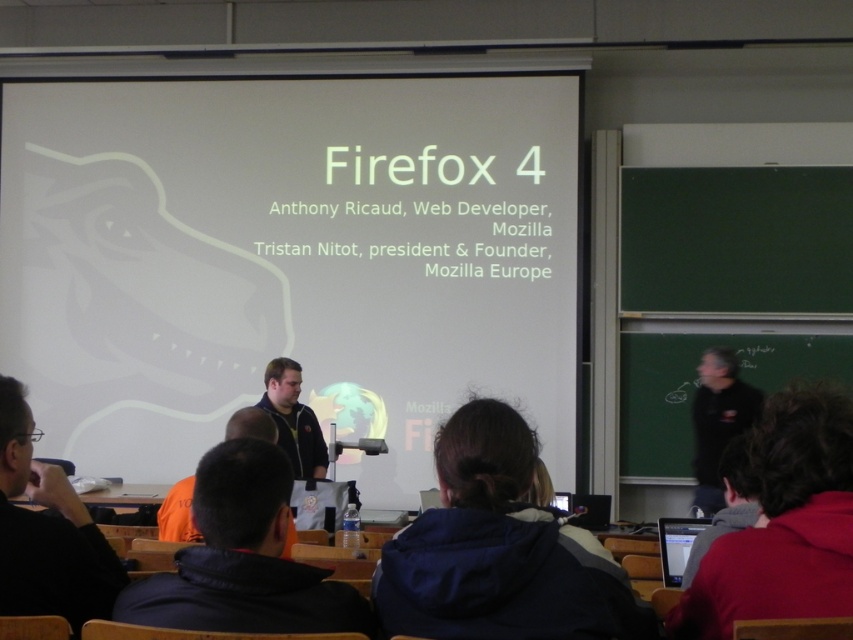
From the picture: Between black matte jacket at lower left and dark blue shirt at center, which one is positioned higher?

Positioned higher is black matte jacket at lower left.

Which of these two, black matte jacket at lower left or dark blue shirt at center, stands shorter?

dark blue shirt at center is shorter.

Which is in front, point (39, 493) or point (276, 436)?

Positioned in front is point (39, 493).

Identify the location of black matte jacket at lower left. tap(45, 531).

Looking at this image, which is below, white matte projection screen at center or dark blue shirt at center?

dark blue shirt at center is below.

Is white matte projection screen at center closer to the viewer compared to dark blue shirt at center?

No, it is not.

Describe the element at coordinates (288, 260) in the screenshot. This screenshot has height=640, width=853. I see `white matte projection screen at center` at that location.

You are a GUI agent. You are given a task and a screenshot of the screen. Output one action in this format:
    pyautogui.click(x=<x>, y=<y>)
    Task: Click on the white matte projection screen at center
    This screenshot has height=640, width=853.
    Given the screenshot: What is the action you would take?
    pyautogui.click(x=288, y=260)

Between point (157, 156) and point (82, 556), which one is positioned behind?

The point (157, 156) is more distant.

Who is positioned more to the left, white matte projection screen at center or black matte jacket at lower left?

white matte projection screen at center is more to the left.

Consider the image. Who is more forward, (61, 310) or (22, 586)?

Positioned in front is point (22, 586).

You are a GUI agent. You are given a task and a screenshot of the screen. Output one action in this format:
    pyautogui.click(x=<x>, y=<y>)
    Task: Click on the white matte projection screen at center
    
    Given the screenshot: What is the action you would take?
    pyautogui.click(x=288, y=260)